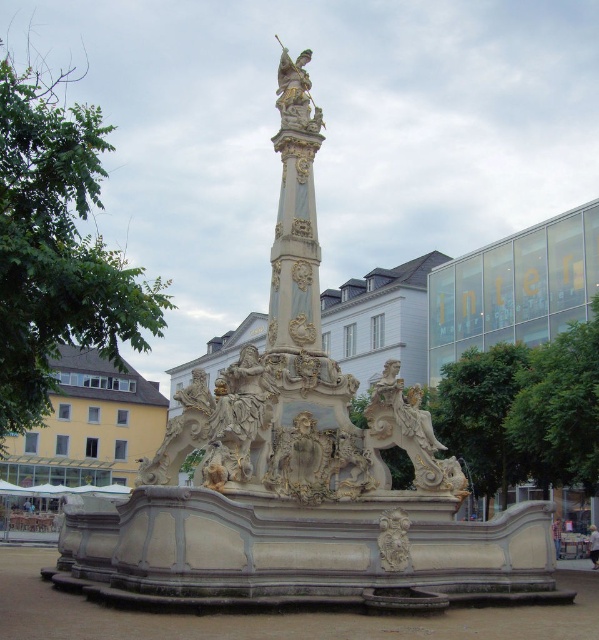
From the picture: Is gold ornate statue at center below carved stone relief at center?

No, gold ornate statue at center is not below carved stone relief at center.

Where is `gold ornate statue at center`? This screenshot has height=640, width=599. gold ornate statue at center is located at coordinates (295, 93).

The height and width of the screenshot is (640, 599). Describe the element at coordinates (295, 93) in the screenshot. I see `gold ornate statue at center` at that location.

The image size is (599, 640). I want to click on gold ornate statue at center, so pyautogui.click(x=295, y=93).